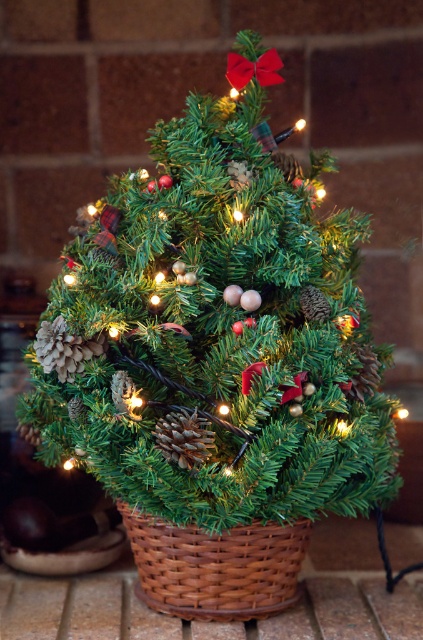
You are a decorator trying to place a new decoration on the green matte christmas tree at center. The decoration requires a space that is at least 20 centimeters away from the brown textured pine cone at center. Can you place it there?

The green matte christmas tree at center is 19.01 centimeters from the brown textured pine cone at center, which is less than the required 20 centimeters. Therefore, you cannot place the decoration there.

You are planning to move the green matte christmas tree at center and the woven brown basket at center to a new location. The doorway you are moving through is narrow. Based on the scene, which object might be harder to maneuver through the doorway and why?

The green matte christmas tree at center might be harder to maneuver through the doorway because its width surpasses that of the woven brown basket at center, making it wider and potentially more difficult to fit through a narrow space.

You are decorating a Christmas tree and want to hang an ornament above the woven brown basket at center. Can you place it above the brown textured pine cone at center instead?

The woven brown basket at center is below the brown textured pine cone at center, so you can place the ornament above the brown textured pine cone at center and it will also be above the woven brown basket at center.